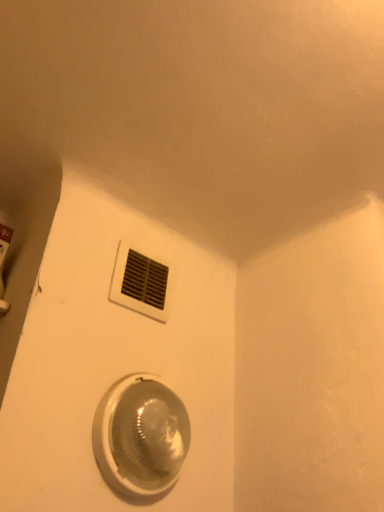
Question: Is white plastic vent at upper center taller or shorter than translucent plastic light fixture at lower center?

Choices:
 (A) tall
 (B) short

Answer: (B)

Question: Is white plastic vent at upper center spatially inside translucent plastic light fixture at lower center, or outside of it?

Choices:
 (A) outside
 (B) inside

Answer: (A)

Question: In the image, is white plastic vent at upper center positioned in front of or behind translucent plastic light fixture at lower center?

Choices:
 (A) behind
 (B) front

Answer: (A)

Question: Considering their positions, is translucent plastic light fixture at lower center located in front of or behind white plastic vent at upper center?

Choices:
 (A) front
 (B) behind

Answer: (A)

Question: Is translucent plastic light fixture at lower center situated inside white plastic vent at upper center or outside?

Choices:
 (A) inside
 (B) outside

Answer: (B)

Question: From a real-world perspective, is translucent plastic light fixture at lower center positioned above or below white plastic vent at upper center?

Choices:
 (A) below
 (B) above

Answer: (A)

Question: Based on their sizes in the image, would you say translucent plastic light fixture at lower center is bigger or smaller than white plastic vent at upper center?

Choices:
 (A) small
 (B) big

Answer: (B)